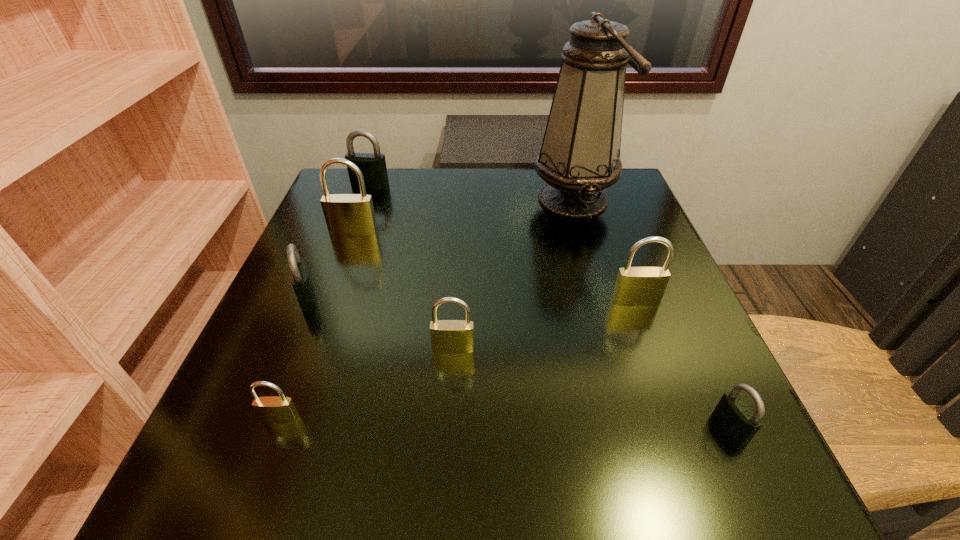
Identify the location of free location located 0.330m on the back of the smallest black padlock. (657, 266).

In order to click on free space located 0.120m on the front-facing side of the nearest brass padlock in this screenshot , I will do `click(247, 510)`.

In order to click on oil lamp that is positioned at the far edge in this screenshot , I will do `click(580, 154)`.

This screenshot has height=540, width=960. In order to click on padlock that is at the far edge in this screenshot , I will do `click(373, 167)`.

I want to click on object that is at the near edge, so click(x=734, y=416).

Locate an element on the screen. oil lamp that is at the right edge is located at coordinates (580, 154).

I want to click on object that is at the far left corner, so click(373, 167).

The width and height of the screenshot is (960, 540). Identify the location of object situated at the far right corner. (580, 154).

Identify the location of object located at the near right corner. (734, 416).

The width and height of the screenshot is (960, 540). In the image, there is a desktop. What are the coordinates of `free space at the far edge` in the screenshot? It's located at [432, 184].